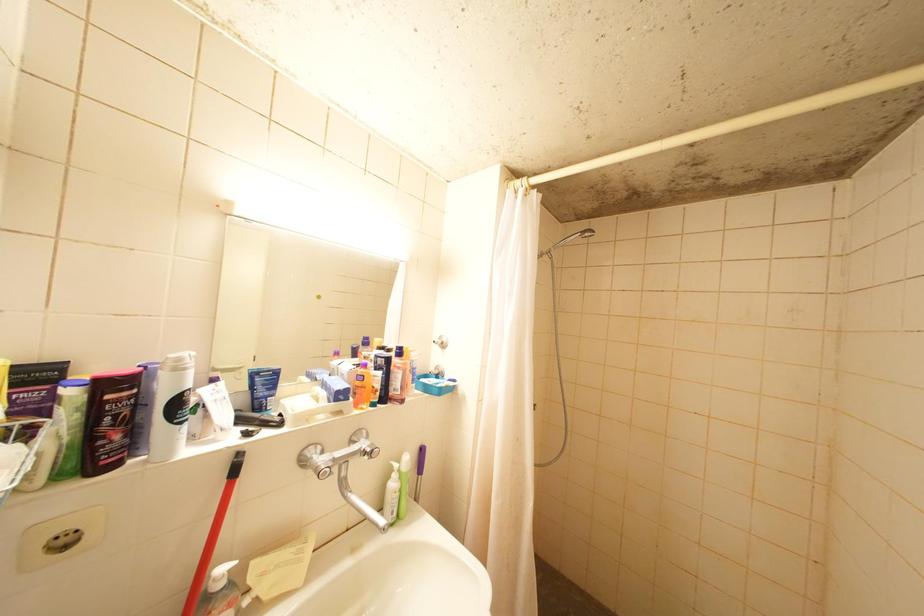
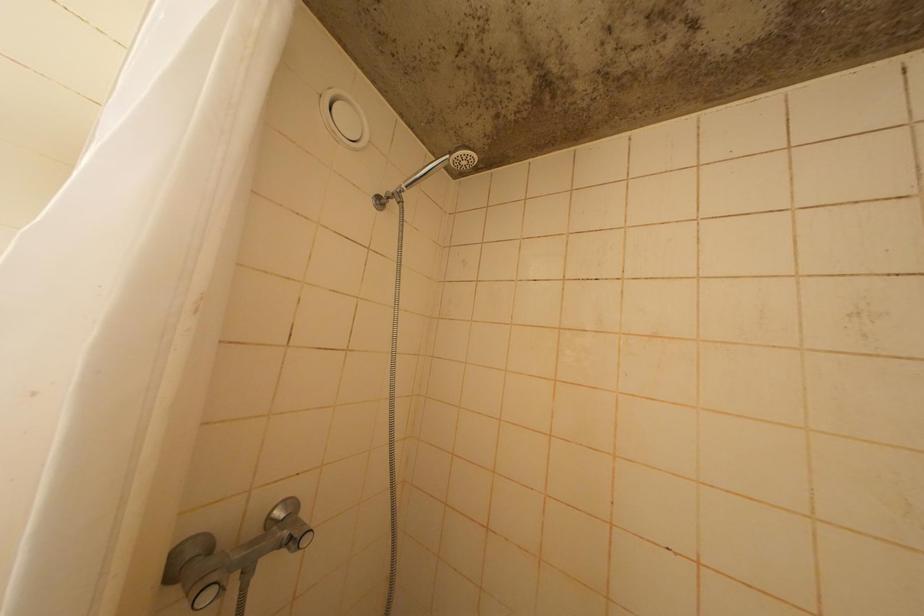
Question: Based on the continuous images, in which direction is the camera rotating? Reply with the corresponding letter.

Choices:
 (A) Left
 (B) Right
 (C) Up
 (D) Down

Answer: (B)